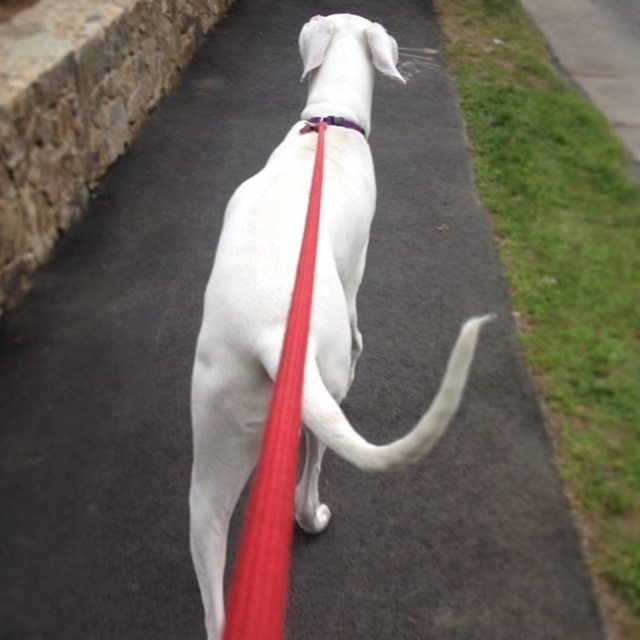
Question: Which is nearer to the white smooth tail at center?

Choices:
 (A) grassy sidewalk at right
 (B) white smooth dog at center
 (C) red rubber leash at center

Answer: (C)

Question: Based on their relative distances, which object is farther from the white smooth tail at center?

Choices:
 (A) purple fabric neckband at center
 (B) grassy sidewalk at right
 (C) white smooth dog at center

Answer: (B)

Question: Considering the real-world distances, which object is closest to the grassy sidewalk at right?

Choices:
 (A) white smooth dog at center
 (B) purple fabric neckband at center
 (C) red rubber leash at center

Answer: (A)

Question: Is white smooth dog at center positioned behind grassy sidewalk at right?

Choices:
 (A) no
 (B) yes

Answer: (A)

Question: Is red rubber leash at center below purple fabric neckband at center?

Choices:
 (A) yes
 (B) no

Answer: (A)

Question: Is white smooth dog at center wider than purple fabric neckband at center?

Choices:
 (A) no
 (B) yes

Answer: (B)